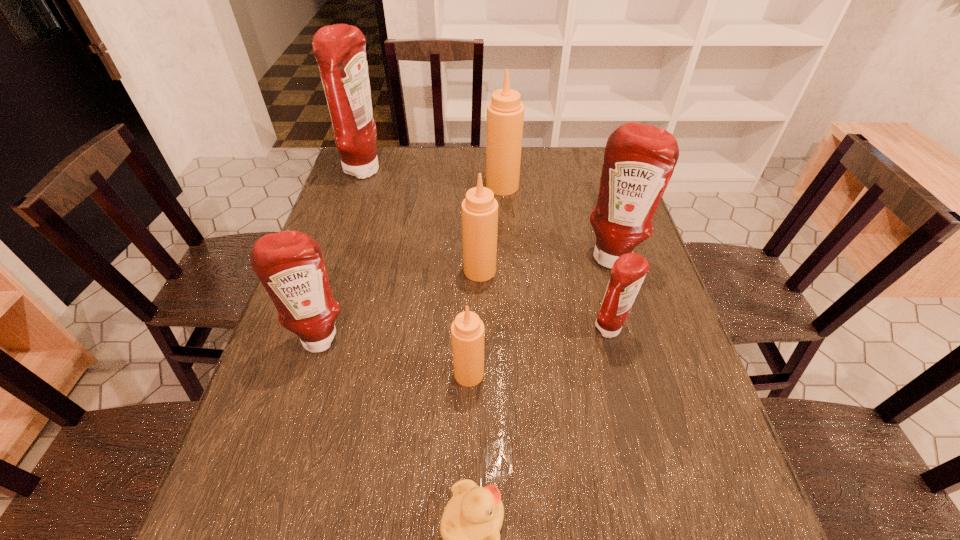
Choose which condiment is the nearest neighbor to the second smallest red condiment. Please provide its 2D coordinates. Your answer should be formatted as a tuple, i.e. [(x, y)], where the tuple contains the x and y coordinates of a point satisfying the conditions above.

[(467, 330)]

Locate which condiment is the fourth closest to the duckling. Please provide its 2D coordinates. Your answer should be formatted as a tuple, i.e. [(x, y)], where the tuple contains the x and y coordinates of a point satisfying the conditions above.

[(479, 209)]

The image size is (960, 540). I want to click on the second closest red condiment relative to the third smallest red condiment, so click(x=290, y=265).

You are a GUI agent. You are given a task and a screenshot of the screen. Output one action in this format:
    pyautogui.click(x=<x>, y=<y>)
    Task: Click on the closest red condiment to the smallest red condiment
    The width and height of the screenshot is (960, 540).
    Given the screenshot: What is the action you would take?
    pyautogui.click(x=639, y=160)

What are the coordinates of `tan condiment that can be found as the closest to the farthest red condiment` in the screenshot? It's located at (505, 113).

Identify the location of the second closest tan condiment to the second farthest tan condiment. (505, 113).

Find the location of a particular element. The height and width of the screenshot is (540, 960). vacant space that satisfies the following two spatial constraints: 1. on the front side of the farthest tan condiment; 2. on the right side of the third smallest red condiment is located at coordinates (507, 255).

Find the location of a particular element. This screenshot has width=960, height=540. vacant position in the image that satisfies the following two spatial constraints: 1. on the back side of the second nearest tan condiment; 2. on the left side of the smallest tan condiment is located at coordinates (471, 270).